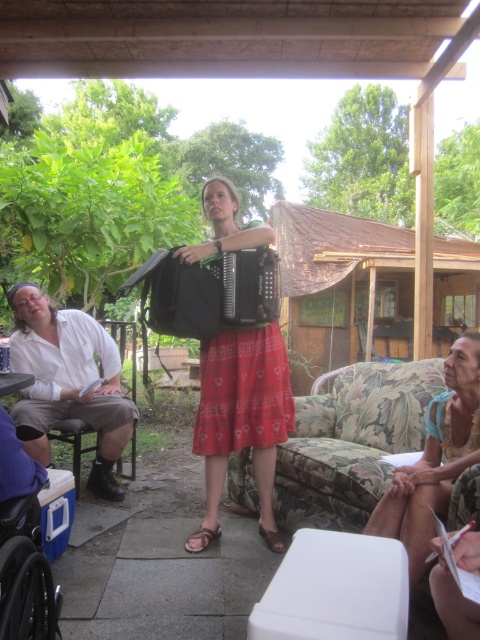
Question: Can you confirm if blue fabric headband at lower right is thinner than black plastic wheelchair at lower left?

Choices:
 (A) no
 (B) yes

Answer: (A)

Question: Where is black matte accordion at center located in relation to black plastic wheelchair at lower left in the image?

Choices:
 (A) below
 (B) above

Answer: (B)

Question: Which point appears farthest from the camera in this image?

Choices:
 (A) coord(260,349)
 (B) coord(27,496)

Answer: (A)

Question: Which point is farther to the camera?

Choices:
 (A) (120, 285)
 (B) (462, 417)
 (C) (41, 461)

Answer: (C)

Question: Considering the real-world distances, which object is farthest from the white cotton shirt at left?

Choices:
 (A) floral fabric couch at lower center
 (B) blue fabric headband at lower right
 (C) black plastic wheelchair at lower left

Answer: (B)

Question: Is floral fabric couch at lower center to the left of blue fabric headband at lower right from the viewer's perspective?

Choices:
 (A) yes
 (B) no

Answer: (A)